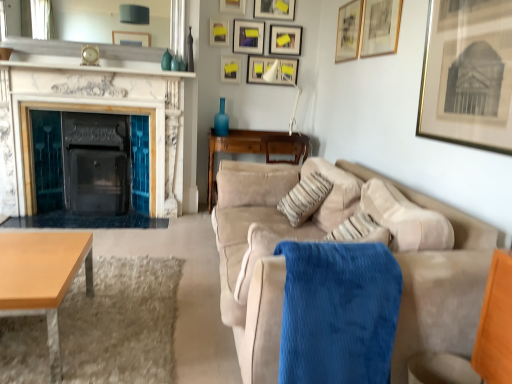
Question: Does gold-framed print at upper right, the first picture frame from the front, have a lesser width compared to beige fabric pillow at center?

Choices:
 (A) yes
 (B) no

Answer: (A)

Question: Does gold-framed print at upper right, which is counted as the 10th picture frame, starting from the back, contain beige fabric pillow at center?

Choices:
 (A) no
 (B) yes

Answer: (A)

Question: Does gold-framed print at upper right, which is counted as the 10th picture frame, starting from the back, lie in front of beige fabric pillow at center?

Choices:
 (A) no
 (B) yes

Answer: (B)

Question: From the image's perspective, is gold-framed print at upper right, the first picture frame from the front, over beige fabric pillow at center?

Choices:
 (A) no
 (B) yes

Answer: (B)

Question: From a real-world perspective, is gold-framed print at upper right, the first picture frame from the front, positioned over beige fabric pillow at center based on gravity?

Choices:
 (A) no
 (B) yes

Answer: (B)

Question: Considering the relative positions of gold-framed print at upper right, which is counted as the 10th picture frame, starting from the back, and beige fabric pillow at center in the image provided, is gold-framed print at upper right, which is counted as the 10th picture frame, starting from the back, to the right of beige fabric pillow at center from the viewer's perspective?

Choices:
 (A) yes
 (B) no

Answer: (A)

Question: From a real-world perspective, is wooden table at lower left positioned under gold-framed print at upper right, the first picture frame from the front, based on gravity?

Choices:
 (A) no
 (B) yes

Answer: (B)

Question: Is wooden table at lower left placed right next to gold-framed print at upper right, which is counted as the 10th picture frame, starting from the back?

Choices:
 (A) no
 (B) yes

Answer: (A)

Question: Does wooden table at lower left come behind gold-framed print at upper right, the first picture frame from the front?

Choices:
 (A) yes
 (B) no

Answer: (A)

Question: Would you consider wooden table at lower left to be distant from gold-framed print at upper right, the first picture frame from the front?

Choices:
 (A) no
 (B) yes

Answer: (B)

Question: Does wooden table at lower left have a smaller size compared to gold-framed print at upper right, the first picture frame from the front?

Choices:
 (A) no
 (B) yes

Answer: (A)

Question: From the image's perspective, does wooden table at lower left appear lower than gold-framed print at upper right, which is counted as the 10th picture frame, starting from the back?

Choices:
 (A) yes
 (B) no

Answer: (A)

Question: Is beige fabric pillow at center turned away from light brown wooden coffee table at lower left?

Choices:
 (A) yes
 (B) no

Answer: (B)